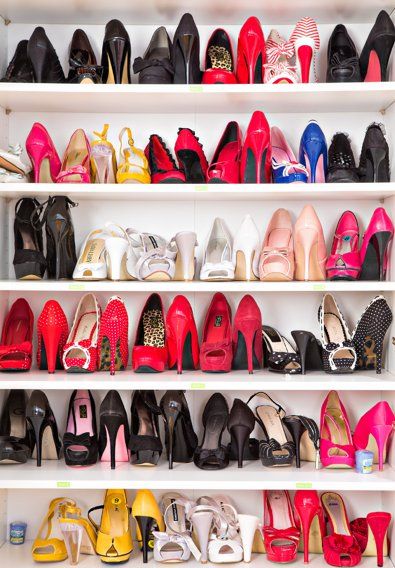
The height and width of the screenshot is (568, 395). I want to click on planks of wood holding shoes, so click(6, 183), click(8, 282), click(13, 380), click(15, 480), click(12, 558).